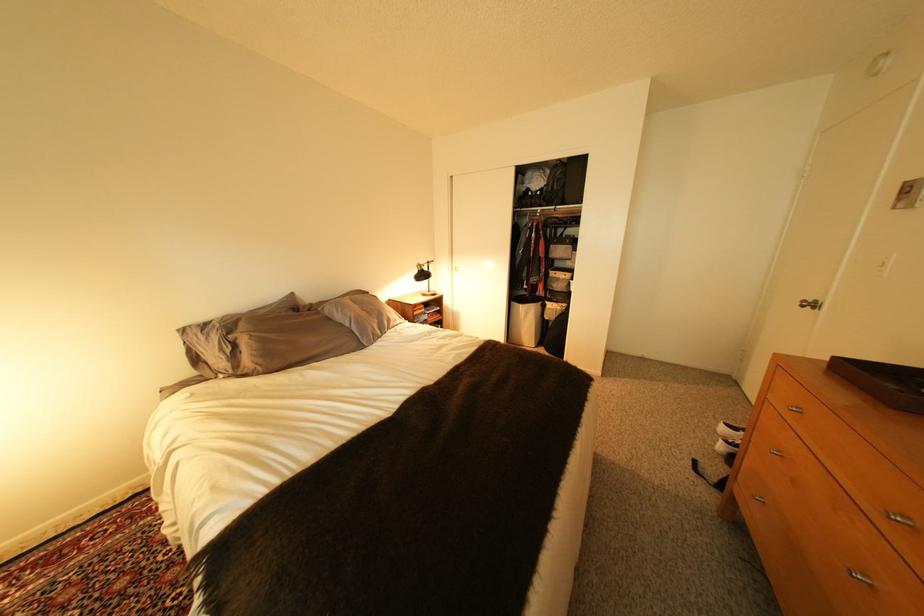
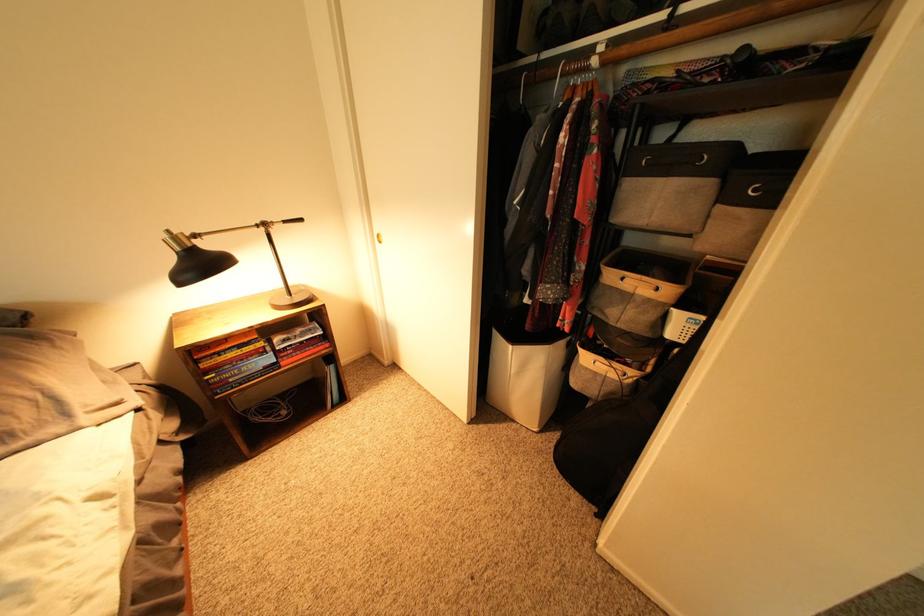
Find the pixel in the second image that matches the point at 429,273 in the first image.

(198, 254)